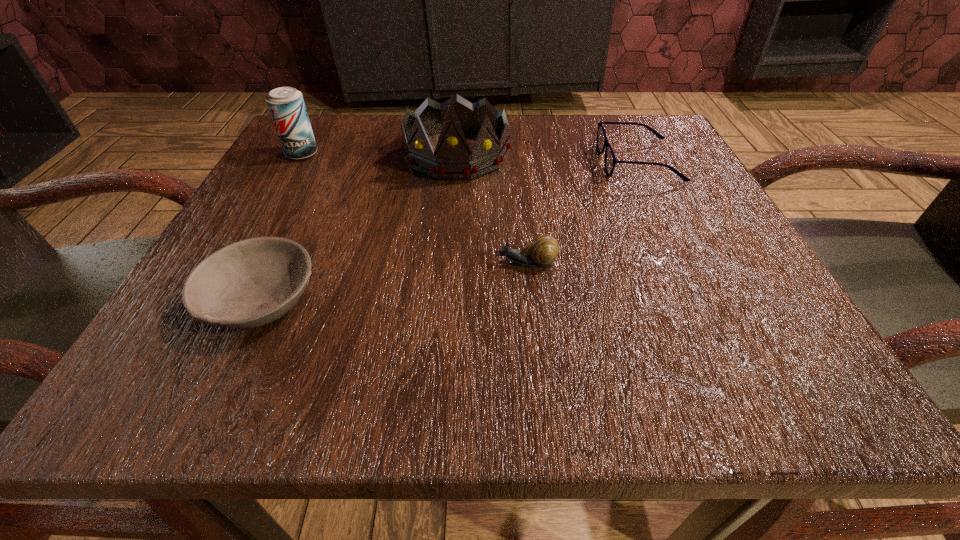
Find the location of a particular element. The height and width of the screenshot is (540, 960). tiara is located at coordinates (452, 160).

You are a GUI agent. You are given a task and a screenshot of the screen. Output one action in this format:
    pyautogui.click(x=<x>, y=<y>)
    Task: Click on the fourth shortest object
    The image size is (960, 540).
    Given the screenshot: What is the action you would take?
    pyautogui.click(x=286, y=105)

I want to click on escargot, so click(543, 250).

The image size is (960, 540). Find the location of `spectacles`. spectacles is located at coordinates (610, 161).

The height and width of the screenshot is (540, 960). Find the location of `bowl`. bowl is located at coordinates (252, 282).

I want to click on vacant space located at the front of the tiara with jewels, so click(x=451, y=221).

Locate an element on the screen. vacant point located 0.270m on the right of the beer can is located at coordinates (465, 154).

Where is `free spot located on the front-facing side of the escargot`? Image resolution: width=960 pixels, height=540 pixels. free spot located on the front-facing side of the escargot is located at coordinates (318, 263).

You are a GUI agent. You are given a task and a screenshot of the screen. Output one action in this format:
    pyautogui.click(x=<x>, y=<y>)
    Task: Click on the vacant space situated 0.260m on the front-facing side of the escargot
    
    Given the screenshot: What is the action you would take?
    pyautogui.click(x=303, y=263)

Find the location of a particular element. blank space located 0.280m on the front-facing side of the escargot is located at coordinates (289, 263).